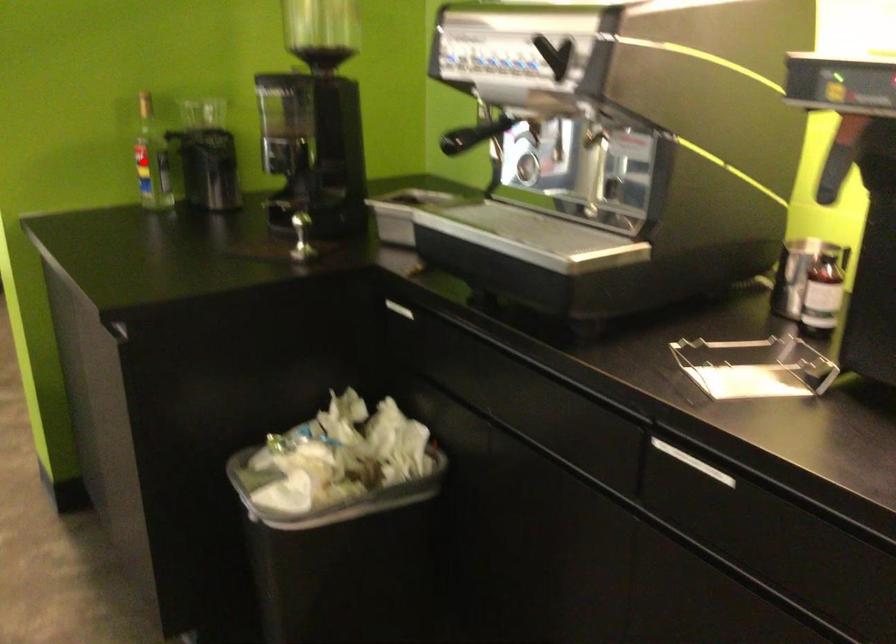
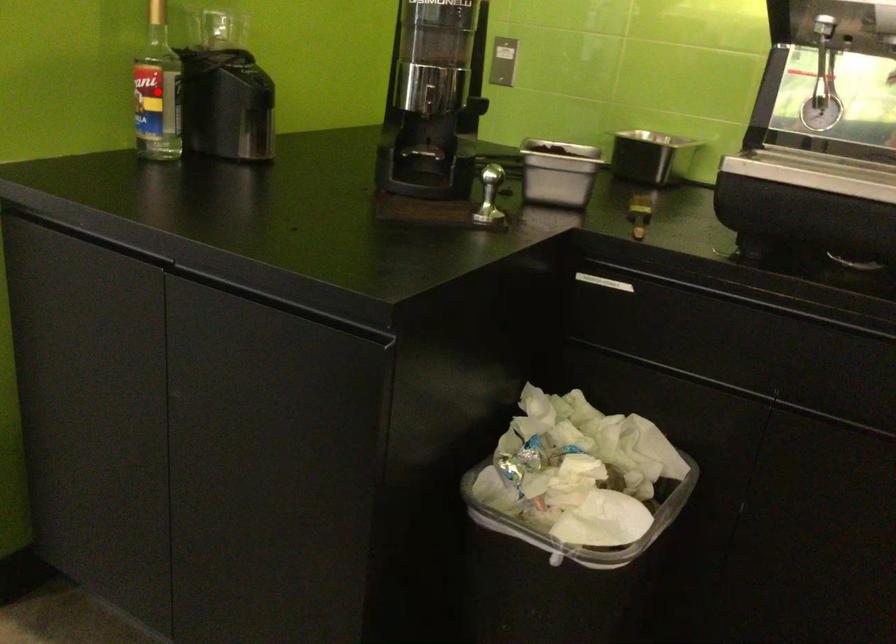
I am providing you with two images of the same scene from different viewpoints. A red point is marked on the first image and another point is marked on the second image. Do the highlighted points in image1 and image2 indicate the same real-world spot?

Yes